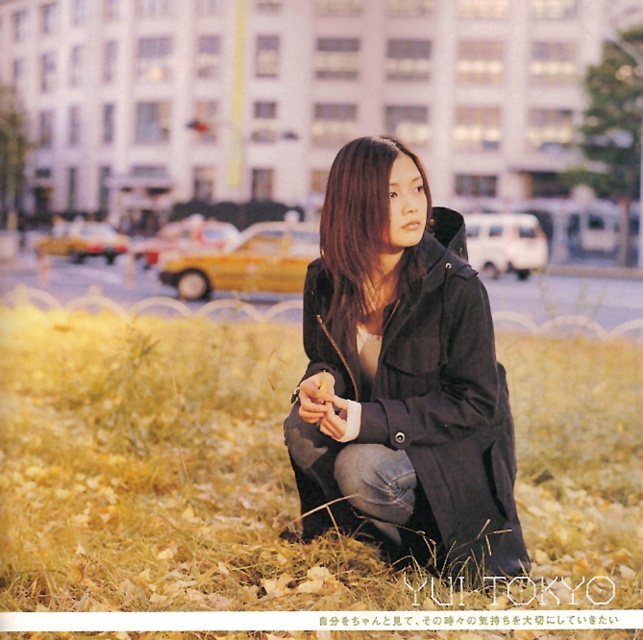
Can you confirm if yellow dry grass at lower center is taller than smooth black hair at center?

Correct, yellow dry grass at lower center is much taller as smooth black hair at center.

Where is `yellow dry grass at lower center`? yellow dry grass at lower center is located at coordinates (161, 472).

Where is `yellow dry grass at lower center`? The height and width of the screenshot is (640, 643). yellow dry grass at lower center is located at coordinates (161, 472).

Can you confirm if yellow dry grass at lower center is positioned to the left of black matte jacket at center?

Correct, you'll find yellow dry grass at lower center to the left of black matte jacket at center.

Who is shorter, yellow dry grass at lower center or black matte jacket at center?

yellow dry grass at lower center

Describe the element at coordinates (161, 472) in the screenshot. This screenshot has height=640, width=643. I see `yellow dry grass at lower center` at that location.

Where is `yellow dry grass at lower center`? Image resolution: width=643 pixels, height=640 pixels. yellow dry grass at lower center is located at coordinates (161, 472).

Is black matte jacket at center to the right of smooth black hair at center from the viewer's perspective?

Correct, you'll find black matte jacket at center to the right of smooth black hair at center.

Who is higher up, black matte jacket at center or smooth black hair at center?

smooth black hair at center is above.

The height and width of the screenshot is (640, 643). Find the location of `black matte jacket at center`. black matte jacket at center is located at coordinates (403, 372).